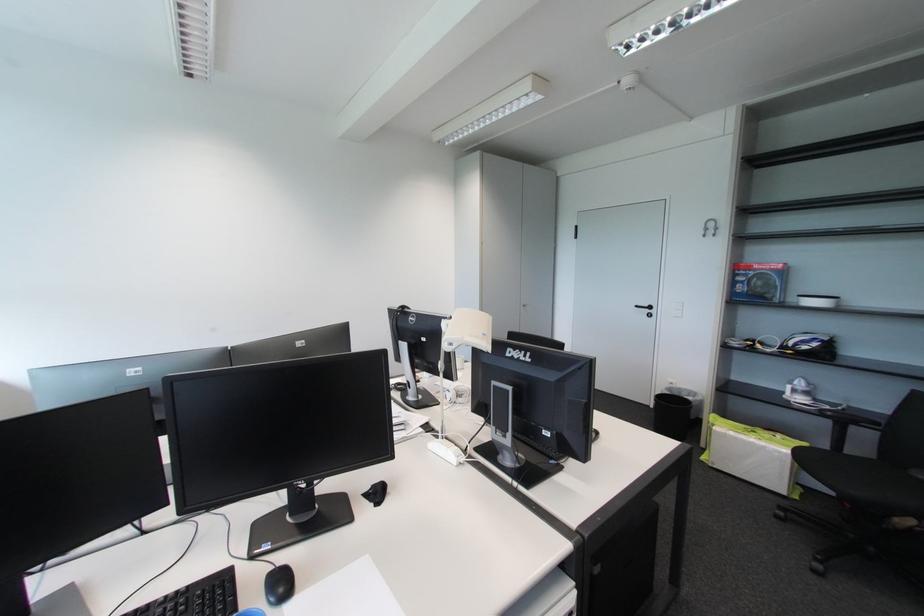
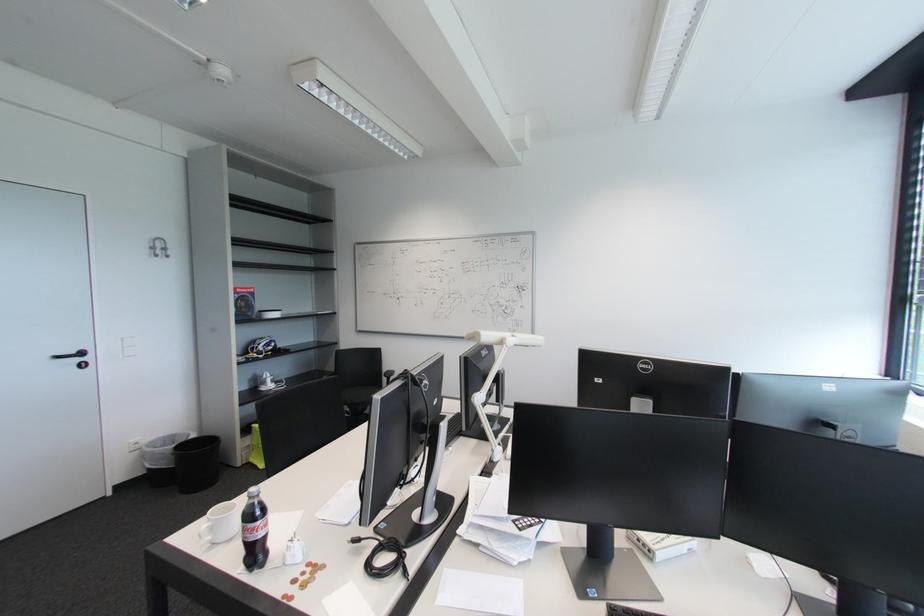
Where in the second image is the point corresponding to point (762, 268) from the first image?

(246, 292)